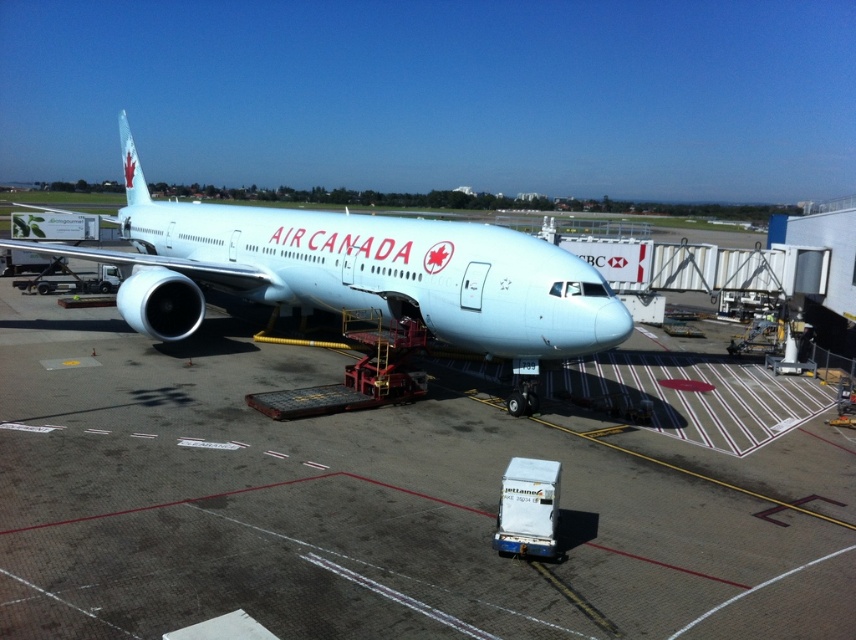
You are a passenger standing at the terminal entrance and see the white glossy tarmac at center and the light blue metallic airplane at center. Which object is located to the right of the airplane?

The white glossy tarmac at center is positioned on the right side of the light blue metallic airplane at center.

You are standing at the airport gate and see the Air Canada aircraft connected to the jet bridge. Where is the white glossy tarmac at center located in relation to the jet bridge?

The white glossy tarmac at center is located at the coordinates point (x=376, y=506) in the image, which would place it near the center of the scene, possibly between the aircraft and the jet bridge or along the path leading towards the terminal.

You are a baggage cart driver who needs to move a cart that is 3 meters wide from the white glossy tarmac at center to the light blue metallic airplane at center. Can you safely maneuver the cart through the space between them?

The distance between the white glossy tarmac at center and the light blue metallic airplane at center is 4.17 meters. Since the cart is 3 meters wide, there is enough space to safely maneuver the cart through the 4.17 meters gap.